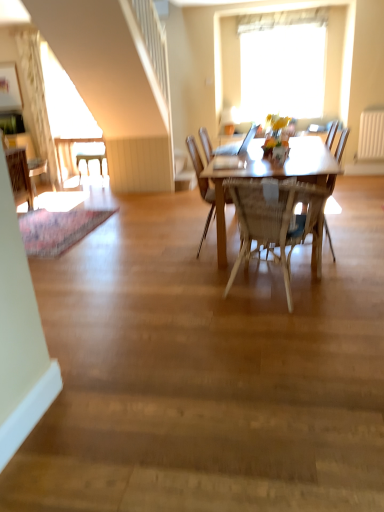
Question: Is white glossy desk at left to the left or to the right of white plastic radiator at right in the image?

Choices:
 (A) right
 (B) left

Answer: (B)

Question: Do you think white glossy desk at left is within white plastic radiator at right, or outside of it?

Choices:
 (A) outside
 (B) inside

Answer: (A)

Question: Which is farther from the light beige textured curtain at upper left?

Choices:
 (A) woven wood chair at center, the 2th chair viewed from the right
 (B) wooden chair at left, the 2th chair positioned from the back
 (C) wooden chair at left, arranged as the third chair when viewed from the front
 (D) light brown wooden table at center
 (E) wooden chair at center, which is the fifth chair in left-to-right order

Answer: (A)

Question: Which object is the closest to the wooden chair at left, arranged as the third chair when viewed from the front?

Choices:
 (A) light brown wooden table at center
 (B) wooden chair at center, which is the fifth chair in left-to-right order
 (C) white plastic chair at left, which is counted as the 1th chair, starting from the back
 (D) transparent glass window at upper center
 (E) white glossy desk at left

Answer: (C)